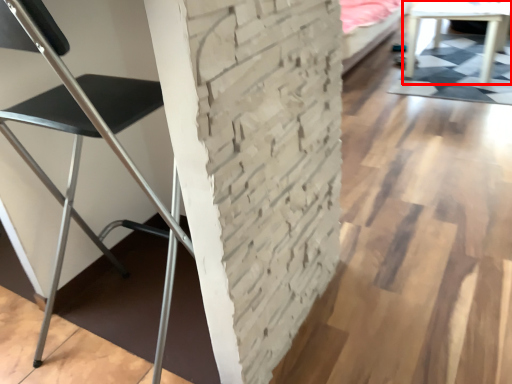
Question: From the image's perspective, what is the correct spatial relationship of table (annotated by the red box) in relation to chair?

Choices:
 (A) above
 (B) below

Answer: (A)